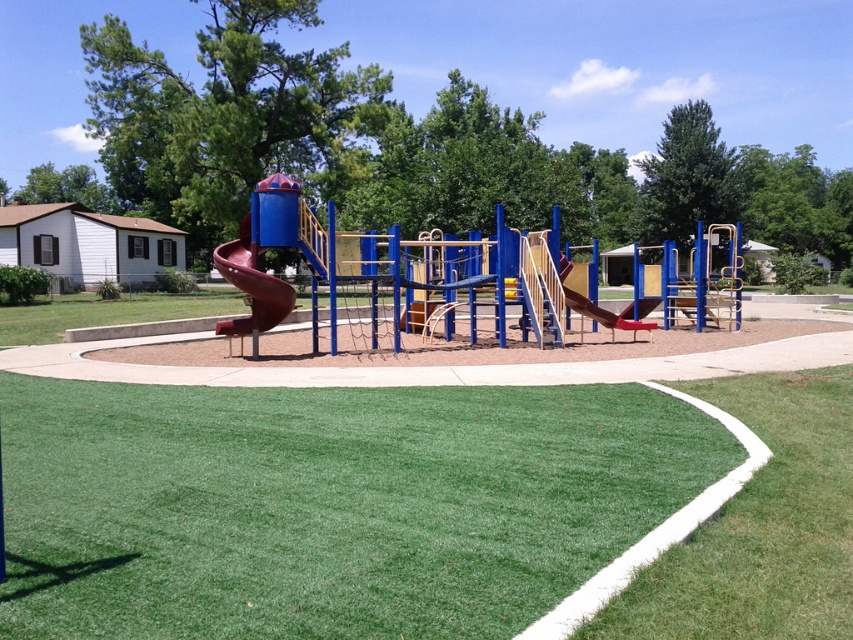
Is green turf at lower right in front of rubberized smooth slide at center-left?

Yes, green turf at lower right is closer to the viewer.

Which is in front, point (651, 636) or point (285, 292)?

Point (651, 636) is more forward.

Where is `green turf at lower right`? This screenshot has height=640, width=853. green turf at lower right is located at coordinates (759, 525).

Between rubberized smooth slide at center-left and brown matte slide at center, which one appears on the left side from the viewer's perspective?

rubberized smooth slide at center-left

In the scene shown: Is rubberized smooth slide at center-left above brown matte slide at center?

Correct, rubberized smooth slide at center-left is located above brown matte slide at center.

What do you see at coordinates (251, 284) in the screenshot? The image size is (853, 640). I see `rubberized smooth slide at center-left` at bounding box center [251, 284].

Where is `rubberized smooth slide at center-left`? The height and width of the screenshot is (640, 853). rubberized smooth slide at center-left is located at coordinates (251, 284).

Who is positioned more to the right, green turf at lower right or brown matte slide at center?

From the viewer's perspective, brown matte slide at center appears more on the right side.

Which is behind, point (752, 600) or point (602, 308)?

Point (602, 308)

I want to click on green turf at lower right, so click(759, 525).